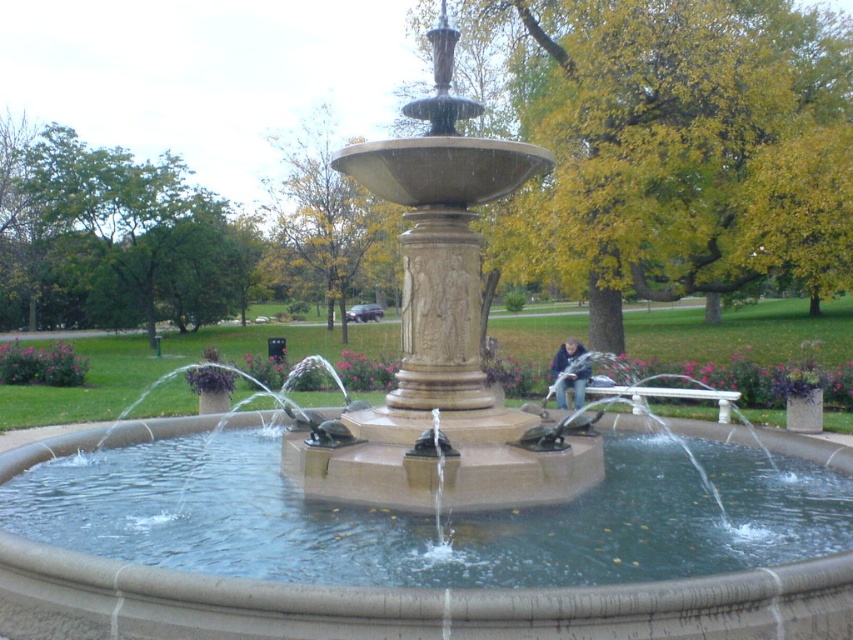
Is white marble bench at lower right behind blue denim jacket at center?

That is False.

Can you confirm if white marble bench at lower right is bigger than blue denim jacket at center?

Yes.

The width and height of the screenshot is (853, 640). Find the location of `white marble bench at lower right`. white marble bench at lower right is located at coordinates (663, 396).